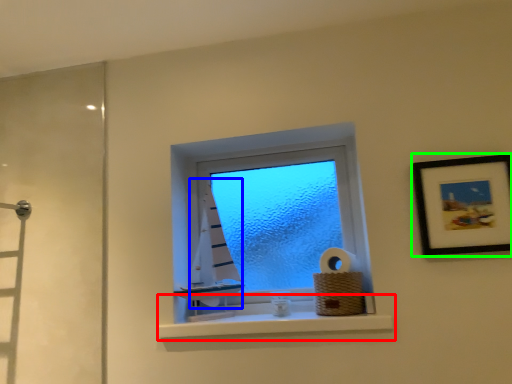
Question: Considering the real-world distances, which object is farthest from window sill (highlighted by a red box)? curtain (highlighted by a blue box) or picture frame (highlighted by a green box)?

Choices:
 (A) curtain
 (B) picture frame

Answer: (B)